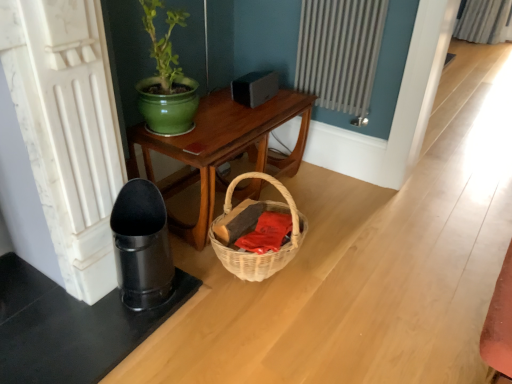
Question: Considering the relative sizes of white textured radiator at upper center and woven wood table at center in the image provided, is white textured radiator at upper center taller than woven wood table at center?

Choices:
 (A) no
 (B) yes

Answer: (B)

Question: Is white textured radiator at upper center further to camera compared to woven wood table at center?

Choices:
 (A) yes
 (B) no

Answer: (A)

Question: Does white textured radiator at upper center have a larger size compared to woven wood table at center?

Choices:
 (A) no
 (B) yes

Answer: (A)

Question: Is woven wood table at center at the back of white textured radiator at upper center?

Choices:
 (A) no
 (B) yes

Answer: (A)

Question: Could you tell me if white textured radiator at upper center is facing woven wood table at center?

Choices:
 (A) yes
 (B) no

Answer: (A)

Question: Is point (257, 180) positioned closer to the camera than point (314, 34)?

Choices:
 (A) closer
 (B) farther

Answer: (B)

Question: Looking at the image, does woven wood table at center seem bigger or smaller compared to white textured radiator at upper center?

Choices:
 (A) small
 (B) big

Answer: (B)

Question: From their relative heights in the image, would you say woven wood table at center is taller or shorter than white textured radiator at upper center?

Choices:
 (A) short
 (B) tall

Answer: (A)

Question: In the image, is woven wood table at center positioned in front of or behind white textured radiator at upper center?

Choices:
 (A) front
 (B) behind

Answer: (A)

Question: From the image's perspective, relative to white textured radiator at upper center, is red cotton cloth at lower center above or below?

Choices:
 (A) below
 (B) above

Answer: (A)

Question: In the image, is red cotton cloth at lower center positioned in front of or behind white textured radiator at upper center?

Choices:
 (A) front
 (B) behind

Answer: (A)

Question: Is point (251, 251) closer or farther from the camera than point (353, 64)?

Choices:
 (A) farther
 (B) closer

Answer: (B)

Question: From a real-world perspective, is red cotton cloth at lower center above or below white textured radiator at upper center?

Choices:
 (A) above
 (B) below

Answer: (B)

Question: From a real-world perspective, is green ceramic pot at upper center above or below red cotton cloth at lower center?

Choices:
 (A) below
 (B) above

Answer: (B)

Question: Is green ceramic pot at upper center situated inside red cotton cloth at lower center or outside?

Choices:
 (A) outside
 (B) inside

Answer: (A)